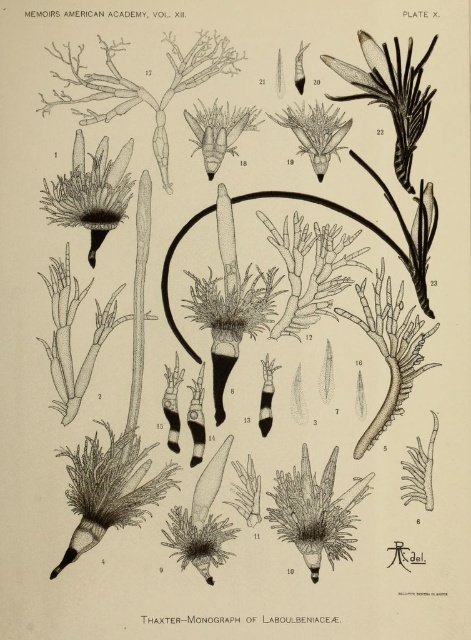
Question: Is dark brown textured flower at upper left positioned at the back of dark green textured flower at center?

Choices:
 (A) yes
 (B) no

Answer: (B)

Question: Which of the following is the farthest from the observer?

Choices:
 (A) dark green textured flower at center
 (B) dark brown textured flower at upper left

Answer: (A)

Question: Does dark brown textured flower at upper left have a lesser width compared to dark green textured flower at center?

Choices:
 (A) no
 (B) yes

Answer: (A)

Question: Where is dark brown textured flower at upper left located in relation to dark green textured flower at center in the image?

Choices:
 (A) below
 (B) above

Answer: (A)